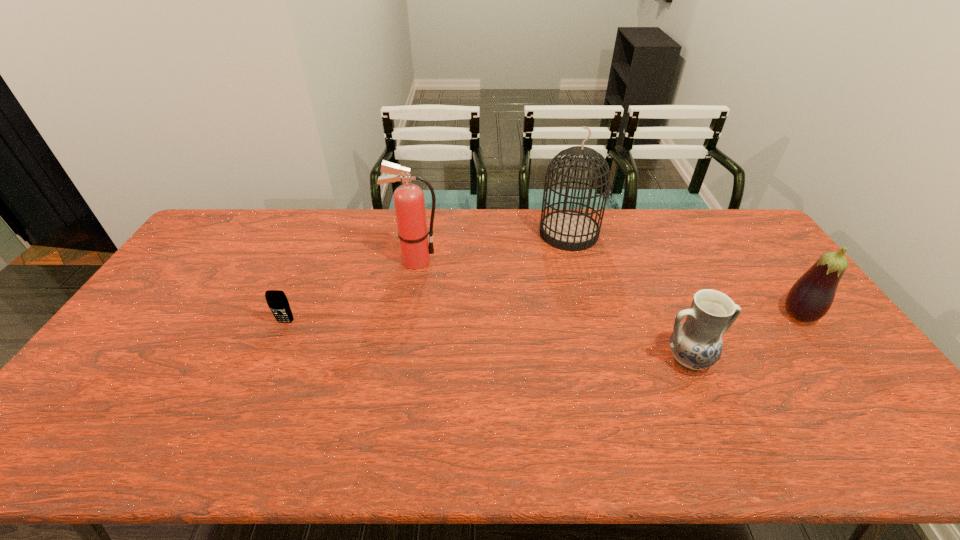
Image resolution: width=960 pixels, height=540 pixels. In order to click on free location that satisfies the following two spatial constraints: 1. on the hose direction of the fourth object from right to left; 2. on the right side of the nearest object in this screenshot , I will do `click(398, 360)`.